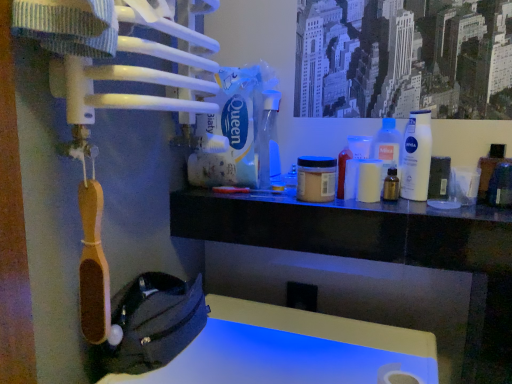
Question: Can you confirm if translucent amber bottle at center, which is the second bottle in left-to-right order, is smaller than transparent plastic spray bottle at center, arranged as the third bottle when viewed from the right?

Choices:
 (A) no
 (B) yes

Answer: (B)

Question: Can transparent plastic spray bottle at center, arranged as the third bottle when viewed from the right, be found inside translucent amber bottle at center, which appears as the 2th bottle when viewed from the right?

Choices:
 (A) yes
 (B) no

Answer: (B)

Question: Can you confirm if translucent amber bottle at center, which is the second bottle in left-to-right order, is bigger than transparent plastic spray bottle at center, the 1th bottle viewed from the left?

Choices:
 (A) no
 (B) yes

Answer: (A)

Question: Does translucent amber bottle at center, which appears as the 2th bottle when viewed from the right, have a lesser height compared to transparent plastic spray bottle at center, the 1th bottle viewed from the left?

Choices:
 (A) no
 (B) yes

Answer: (B)

Question: Are translucent amber bottle at center, which is the second bottle in left-to-right order, and transparent plastic spray bottle at center, the 1th bottle viewed from the left, located far from each other?

Choices:
 (A) yes
 (B) no

Answer: (B)

Question: Considering the positions of translucent amber bottle at center, which appears as the 2th bottle when viewed from the right, and transparent plastic spray bottle at center, the 1th bottle viewed from the left, in the image, is translucent amber bottle at center, which appears as the 2th bottle when viewed from the right, taller or shorter than transparent plastic spray bottle at center, the 1th bottle viewed from the left,?

Choices:
 (A) tall
 (B) short

Answer: (B)

Question: Does point (x=394, y=188) appear closer or farther from the camera than point (x=260, y=125)?

Choices:
 (A) farther
 (B) closer

Answer: (B)

Question: Relative to transparent plastic spray bottle at center, the 1th bottle viewed from the left, is translucent amber bottle at center, which is the second bottle in left-to-right order, in front or behind?

Choices:
 (A) behind
 (B) front

Answer: (B)

Question: Choose the correct answer: Is translucent amber bottle at center, which appears as the 2th bottle when viewed from the right, inside transparent plastic spray bottle at center, arranged as the third bottle when viewed from the right, or outside it?

Choices:
 (A) outside
 (B) inside

Answer: (A)

Question: From the image's perspective, relative to white plastic bottle at upper right, which appears as the third bottle when viewed from the left, is translucent plastic bottle at center right above or below?

Choices:
 (A) below
 (B) above

Answer: (B)

Question: Based on their sizes in the image, would you say translucent plastic bottle at center right is bigger or smaller than white plastic bottle at upper right, which appears as the third bottle when viewed from the left?

Choices:
 (A) big
 (B) small

Answer: (B)

Question: Considering the positions of point (377, 157) and point (430, 153), is point (377, 157) closer or farther from the camera than point (430, 153)?

Choices:
 (A) closer
 (B) farther

Answer: (B)

Question: From a real-world perspective, is translucent plastic bottle at center right positioned above or below white plastic bottle at upper right, placed as the 1th bottle when sorted from right to left?

Choices:
 (A) below
 (B) above

Answer: (A)

Question: From the image's perspective, is white plastic bottle at upper right, placed as the 1th bottle when sorted from right to left, positioned above or below translucent amber bottle at center, which is the second bottle in left-to-right order?

Choices:
 (A) above
 (B) below

Answer: (A)

Question: Is white plastic bottle at upper right, placed as the 1th bottle when sorted from right to left, in front of or behind translucent amber bottle at center, which is the second bottle in left-to-right order, in the image?

Choices:
 (A) behind
 (B) front

Answer: (B)